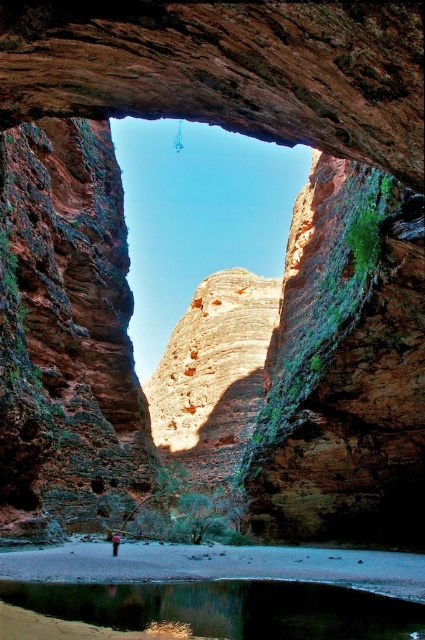
Consider the image. You are standing at the base of the natural rock archway and notice the green reflective water at lower center and the pink fabric person at center. Which object is positioned higher in the scene?

The green reflective water at lower center is taller than the pink fabric person at center, so the green reflective water at lower center is positioned higher in the scene.

You are a photographer planning to capture a landscape shot of the natural rock archway. You notice the green reflective water at lower center and the pink fabric person at center in the scene. Which object will occupy more space in your photo?

The green reflective water at lower center will occupy more space in the photo because it is larger in size than the pink fabric person at center according to the description.